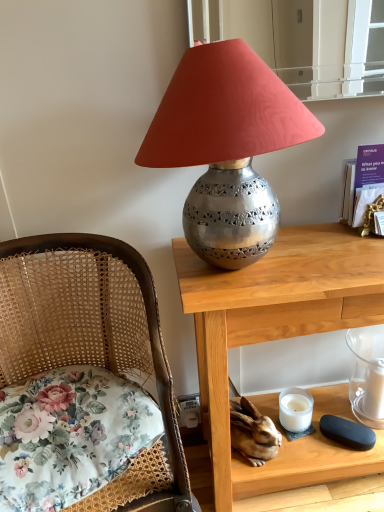
You are a GUI agent. You are given a task and a screenshot of the screen. Output one action in this format:
    pyautogui.click(x=<x>, y=<y>)
    Task: Click on the vacant region under metallic silver lampshade at upper center (from a real-world perspective)
    This screenshot has height=512, width=384.
    Given the screenshot: What is the action you would take?
    click(x=243, y=275)